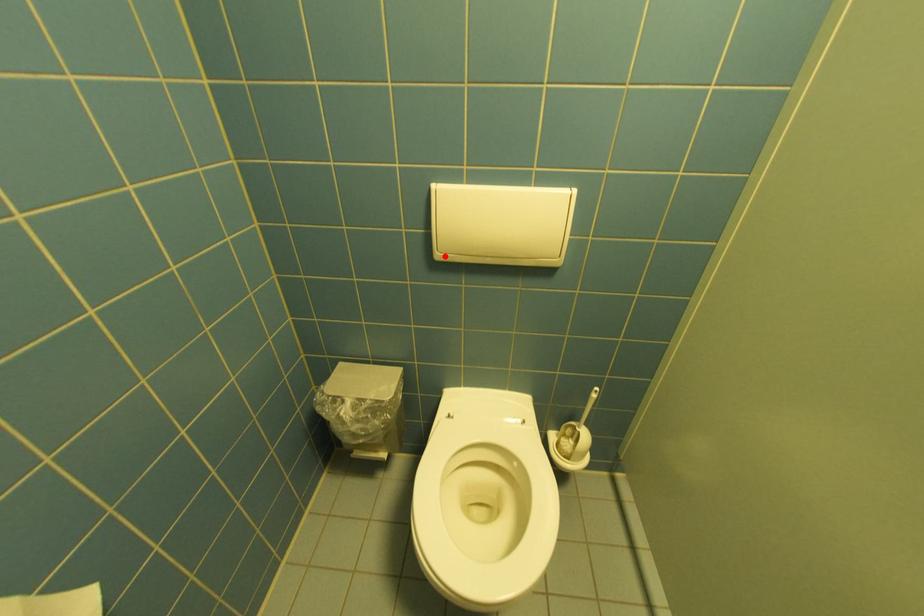
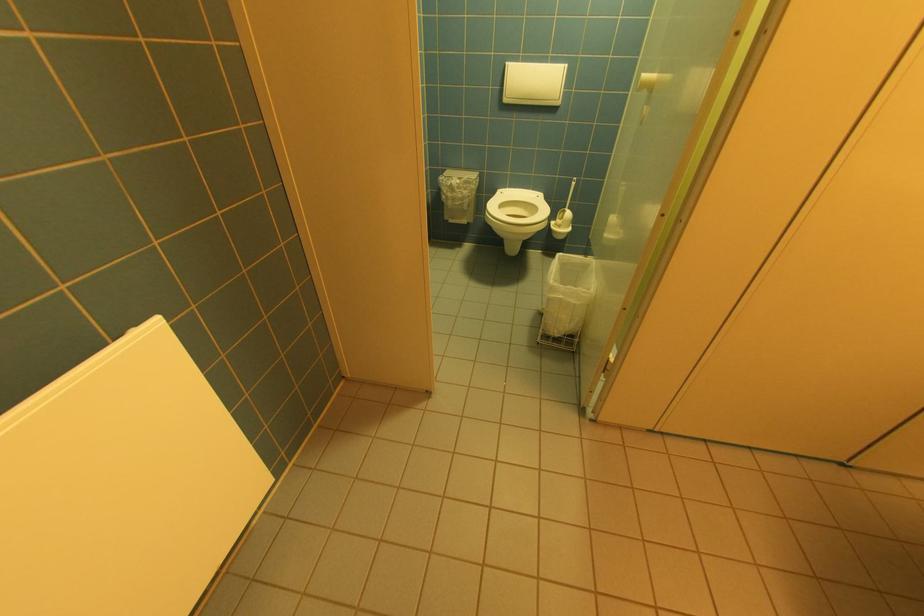
Question: I am providing you with two images of the same scene from different viewpoints. A red point is marked on the first image. Is the red point's position out of view in image 2?

Choices:
 (A) Yes
 (B) No

Answer: (B)